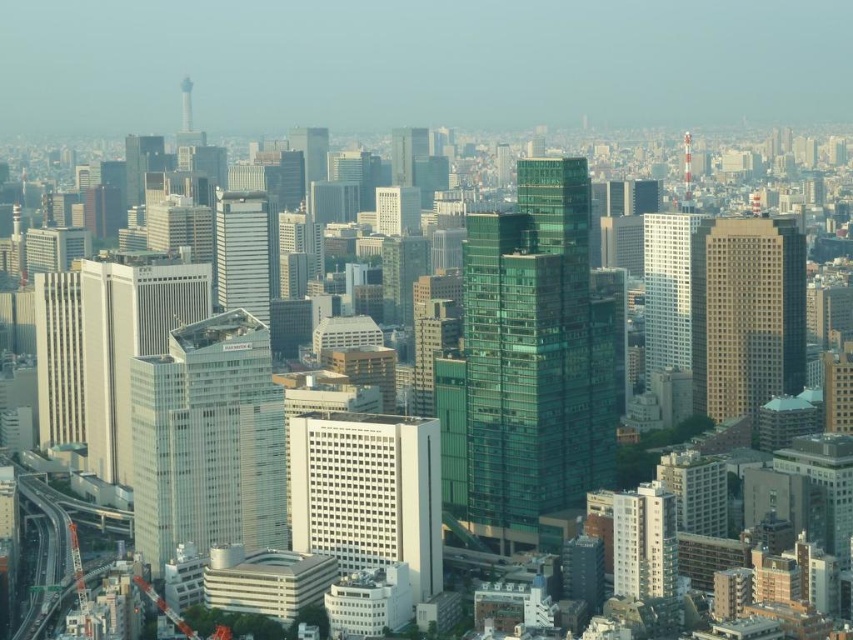
Question: Does white glass building at center have a lesser width compared to white glass building at right?

Choices:
 (A) no
 (B) yes

Answer: (A)

Question: Can you confirm if white matte building at center is bigger than beige concrete skyscraper at right?

Choices:
 (A) no
 (B) yes

Answer: (A)

Question: Which of the following is the farthest from the observer?

Choices:
 (A) white glass building at right
 (B) beige concrete skyscraper at right

Answer: (A)

Question: Where is white glass building at center located in relation to white glass building at right in the image?

Choices:
 (A) above
 (B) below

Answer: (B)

Question: Which of these objects is positioned farthest from the white glass building at center?

Choices:
 (A) beige concrete skyscraper at right
 (B) green glass building at center
 (C) matte glass skyscraper at center

Answer: (C)

Question: Estimate the real-world distances between objects in this image. Which object is farther from the white matte building at center?

Choices:
 (A) matte glass skyscraper at center
 (B) beige concrete skyscraper at right
 (C) white glass building at center
 (D) green glass building at center

Answer: (A)